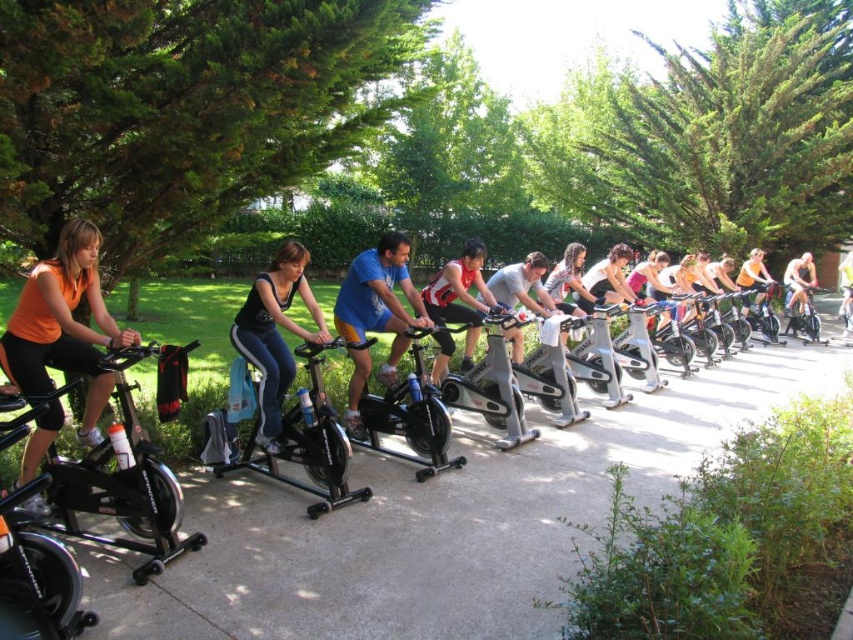
You are a photographer taking a picture of the matte gray tank top at center. What are the coordinates where you should focus your camera?

The coordinates to focus on are (521, 284).

In the outdoor cycling class scene, you notice a matte gray tank top at center and a shiny metallic bicycle at center. Which object is positioned to the left of the other?

The matte gray tank top at center is to the left of the shiny metallic bicycle at center.